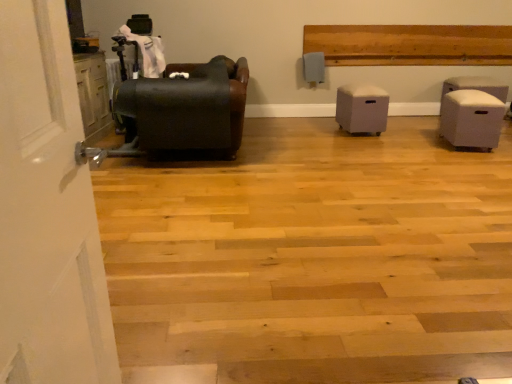
Measure the distance between matte black leather armchair at left, placed as the 3th furniture when sorted from right to left, and camera.

matte black leather armchair at left, placed as the 3th furniture when sorted from right to left, and camera are 3.40 meters apart from each other.

What do you see at coordinates (471, 119) in the screenshot? I see `white fabric ottoman at right, the first furniture in the right-to-left sequence` at bounding box center [471, 119].

What are the coordinates of `matte black leather armchair at left, placed as the 3th furniture when sorted from right to left` in the screenshot? It's located at [188, 108].

Considering the points (468, 129) and (371, 96), which point is behind, point (468, 129) or point (371, 96)?

The point (371, 96) is behind.

Is white fabric ottoman at right, marked as the 3th furniture in a left-to-right arrangement, turned away from light gray fabric ottoman at center, which is the second furniture in left-to-right order?

white fabric ottoman at right, marked as the 3th furniture in a left-to-right arrangement, is not turned away from light gray fabric ottoman at center, which is the second furniture in left-to-right order.

From a real-world perspective, between white fabric ottoman at right, marked as the 3th furniture in a left-to-right arrangement, and light gray fabric ottoman at center, which is the second furniture in left-to-right order, who is vertically higher?

In real-world perspective, light gray fabric ottoman at center, which is the second furniture in left-to-right order, is above.

Is white fabric ottoman at right, marked as the 3th furniture in a left-to-right arrangement, wider than light gray fabric ottoman at center, which is the 2th furniture in right-to-left order?

No.

Considering the relative sizes of light gray fabric ottoman at center, which is the 2th furniture in right-to-left order, and matte black leather armchair at left, arranged as the first furniture when viewed from the left, in the image provided, is light gray fabric ottoman at center, which is the 2th furniture in right-to-left order, wider than matte black leather armchair at left, arranged as the first furniture when viewed from the left,?

No.

From a real-world perspective, which is physically below, light gray fabric ottoman at center, which is the 2th furniture in right-to-left order, or matte black leather armchair at left, arranged as the first furniture when viewed from the left?

light gray fabric ottoman at center, which is the 2th furniture in right-to-left order, from a real-world perspective.

Relative to matte black leather armchair at left, arranged as the first furniture when viewed from the left, is light gray fabric ottoman at center, which is the second furniture in left-to-right order, in front or behind?

In the image, light gray fabric ottoman at center, which is the second furniture in left-to-right order, appears behind matte black leather armchair at left, arranged as the first furniture when viewed from the left.

How many degrees apart are the facing directions of light gray fabric ottoman at center, which is the 2th furniture in right-to-left order, and matte black leather armchair at left, arranged as the first furniture when viewed from the left?

92.5 degrees.

Is matte black leather armchair at left, arranged as the first furniture when viewed from the left, located outside white fabric ottoman at right, marked as the 3th furniture in a left-to-right arrangement?

matte black leather armchair at left, arranged as the first furniture when viewed from the left, lies outside white fabric ottoman at right, marked as the 3th furniture in a left-to-right arrangement,'s area.

Considering the relative positions of matte black leather armchair at left, placed as the 3th furniture when sorted from right to left, and white fabric ottoman at right, marked as the 3th furniture in a left-to-right arrangement, in the image provided, is matte black leather armchair at left, placed as the 3th furniture when sorted from right to left, in front of white fabric ottoman at right, marked as the 3th furniture in a left-to-right arrangement,?

Yes, it is.

Is matte black leather armchair at left, placed as the 3th furniture when sorted from right to left, positioned with its back to white fabric ottoman at right, the first furniture in the right-to-left sequence?

Correct, matte black leather armchair at left, placed as the 3th furniture when sorted from right to left, is looking away from white fabric ottoman at right, the first furniture in the right-to-left sequence.

Is point (122, 107) farther from viewer compared to point (484, 116)?

No, it is in front of (484, 116).

Which point is more forward, (160, 114) or (366, 90)?

The point (160, 114) is closer to the camera.

Find the location of a particular element. This screenshot has width=512, height=384. furniture positioned vertically above the light gray fabric ottoman at center, which is the 2th furniture in right-to-left order (from a real-world perspective) is located at coordinates (188, 108).

Considering the relative sizes of matte black leather armchair at left, arranged as the first furniture when viewed from the left, and light gray fabric ottoman at center, which is the 2th furniture in right-to-left order, in the image provided, is matte black leather armchair at left, arranged as the first furniture when viewed from the left, taller than light gray fabric ottoman at center, which is the 2th furniture in right-to-left order,?

Indeed, matte black leather armchair at left, arranged as the first furniture when viewed from the left, has a greater height compared to light gray fabric ottoman at center, which is the 2th furniture in right-to-left order.

From the image's perspective, is matte black leather armchair at left, arranged as the first furniture when viewed from the left, over light gray fabric ottoman at center, which is the second furniture in left-to-right order?

Yes, from the image's perspective, matte black leather armchair at left, arranged as the first furniture when viewed from the left, is on top of light gray fabric ottoman at center, which is the second furniture in left-to-right order.

From a real-world perspective, is light gray fabric ottoman at center, which is the 2th furniture in right-to-left order, positioned under white fabric ottoman at right, marked as the 3th furniture in a left-to-right arrangement, based on gravity?

Incorrect, from a real-world perspective, light gray fabric ottoman at center, which is the 2th furniture in right-to-left order, is higher than white fabric ottoman at right, marked as the 3th furniture in a left-to-right arrangement.

Based on the photo, which object is further away from the camera taking this photo, light gray fabric ottoman at center, which is the second furniture in left-to-right order, or white fabric ottoman at right, the first furniture in the right-to-left sequence?

light gray fabric ottoman at center, which is the second furniture in left-to-right order, is further from the camera.

Is the surface of light gray fabric ottoman at center, which is the 2th furniture in right-to-left order, in direct contact with white fabric ottoman at right, marked as the 3th furniture in a left-to-right arrangement?

No, light gray fabric ottoman at center, which is the 2th furniture in right-to-left order, is not making contact with white fabric ottoman at right, marked as the 3th furniture in a left-to-right arrangement.

Considering the sizes of white fabric ottoman at right, marked as the 3th furniture in a left-to-right arrangement, and matte black leather armchair at left, placed as the 3th furniture when sorted from right to left, in the image, is white fabric ottoman at right, marked as the 3th furniture in a left-to-right arrangement, taller or shorter than matte black leather armchair at left, placed as the 3th furniture when sorted from right to left,?

In the image, white fabric ottoman at right, marked as the 3th furniture in a left-to-right arrangement, appears to be shorter than matte black leather armchair at left, placed as the 3th furniture when sorted from right to left.

From a real-world perspective, who is located lower, white fabric ottoman at right, the first furniture in the right-to-left sequence, or matte black leather armchair at left, arranged as the first furniture when viewed from the left?

In real-world perspective, white fabric ottoman at right, the first furniture in the right-to-left sequence, is lower.

I want to click on the 1st furniture positioned above the white fabric ottoman at right, the first furniture in the right-to-left sequence (from a real-world perspective), so click(362, 108).

Locate an element on the screen. furniture on the left of light gray fabric ottoman at center, which is the 2th furniture in right-to-left order is located at coordinates (188, 108).

Looking at the image, which one is located further to white fabric ottoman at right, marked as the 3th furniture in a left-to-right arrangement, light gray fabric ottoman at center, which is the 2th furniture in right-to-left order, or matte black leather armchair at left, placed as the 3th furniture when sorted from right to left?

Among the two, matte black leather armchair at left, placed as the 3th furniture when sorted from right to left, is located further to white fabric ottoman at right, marked as the 3th furniture in a left-to-right arrangement.

Based on their spatial positions, is light gray fabric ottoman at center, which is the second furniture in left-to-right order, or white fabric ottoman at right, marked as the 3th furniture in a left-to-right arrangement, closer to matte black leather armchair at left, placed as the 3th furniture when sorted from right to left?

Based on the image, light gray fabric ottoman at center, which is the second furniture in left-to-right order, appears to be nearer to matte black leather armchair at left, placed as the 3th furniture when sorted from right to left.

When comparing their distances from light gray fabric ottoman at center, which is the second furniture in left-to-right order, does matte black leather armchair at left, arranged as the first furniture when viewed from the left, or white fabric ottoman at right, marked as the 3th furniture in a left-to-right arrangement, seem closer?

white fabric ottoman at right, marked as the 3th furniture in a left-to-right arrangement, is positioned closer to the anchor light gray fabric ottoman at center, which is the second furniture in left-to-right order.

Estimate the real-world distances between objects in this image. Which object is further from light gray fabric ottoman at center, which is the 2th furniture in right-to-left order, white fabric ottoman at right, marked as the 3th furniture in a left-to-right arrangement, or matte black leather armchair at left, arranged as the first furniture when viewed from the left?

matte black leather armchair at left, arranged as the first furniture when viewed from the left.

Looking at the image, which one is located closer to matte black leather armchair at left, placed as the 3th furniture when sorted from right to left, white fabric ottoman at right, the first furniture in the right-to-left sequence, or light gray fabric ottoman at center, which is the 2th furniture in right-to-left order?

Based on the image, light gray fabric ottoman at center, which is the 2th furniture in right-to-left order, appears to be nearer to matte black leather armchair at left, placed as the 3th furniture when sorted from right to left.

Which object lies further to the anchor point white fabric ottoman at right, the first furniture in the right-to-left sequence, matte black leather armchair at left, placed as the 3th furniture when sorted from right to left, or light gray fabric ottoman at center, which is the second furniture in left-to-right order?

matte black leather armchair at left, placed as the 3th furniture when sorted from right to left.

Locate an element on the screen. furniture located between matte black leather armchair at left, arranged as the first furniture when viewed from the left, and white fabric ottoman at right, marked as the 3th furniture in a left-to-right arrangement, in the left-right direction is located at coordinates point(362,108).